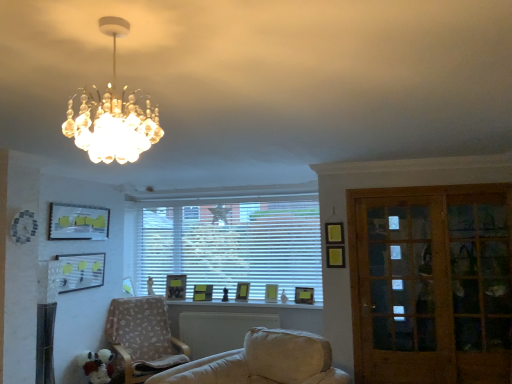
Question: Considering the positions of point (310, 292) and point (273, 301), is point (310, 292) closer or farther from the camera than point (273, 301)?

Choices:
 (A) closer
 (B) farther

Answer: (A)

Question: Considering the positions of matte yellow picture frame at window, which is the 1th picture frame in right-to-left order, and matte yellow picture frame at center, which is counted as the second picture frame, starting from the right, in the image, is matte yellow picture frame at window, which is the 1th picture frame in right-to-left order, taller or shorter than matte yellow picture frame at center, which is counted as the second picture frame, starting from the right,?

Choices:
 (A) short
 (B) tall

Answer: (A)

Question: Estimate the real-world distances between objects in this image. Which object is closer to the matte black picture frame at center, which is the 4th picture frame from right to left?

Choices:
 (A) matte yellow picture frame at window, which is the 1th picture frame in right-to-left order
 (B) matte yellow picture frame at left, positioned as the 6th picture frame in right-to-left order
 (C) matte yellow picture frame at upper left, placed as the seventh picture frame when sorted from right to left
 (D) wooden glass door at right
 (E) white blinds at center

Answer: (E)

Question: Estimate the real-world distances between objects in this image. Which object is closer to the matte yellow picture frame at center, which is counted as the second picture frame, starting from the right?

Choices:
 (A) wooden glass door at right
 (B) matte yellow picture frame at window, placed as the 7th picture frame when sorted from left to right
 (C) beige fabric chair at lower left
 (D) matte yellow picture frame at upper left, the first picture frame positioned from the left
 (E) white blinds at center

Answer: (B)